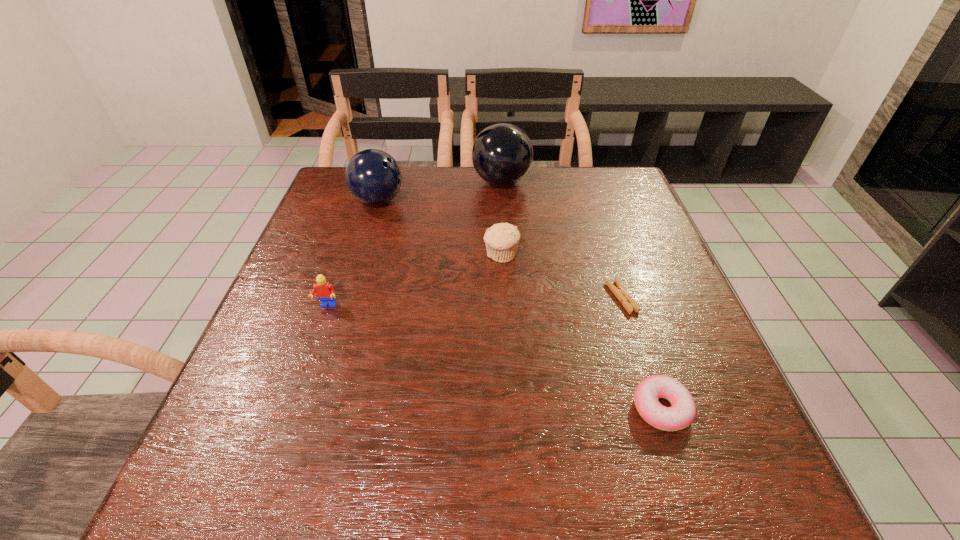
At what (x,y) coordinates should I click in order to perform the action: click on the right bowling ball. Please return your answer as a coordinate pair (x, y). The height and width of the screenshot is (540, 960). Looking at the image, I should click on (502, 154).

The height and width of the screenshot is (540, 960). What are the coordinates of `the second tallest object` in the screenshot? It's located at pos(372,176).

Image resolution: width=960 pixels, height=540 pixels. I want to click on the left bowling ball, so click(372, 176).

Identify the location of the fourth nearest object. This screenshot has width=960, height=540. (502, 239).

At what (x,y) coordinates should I click in order to perform the action: click on Lego. Please return your answer as a coordinate pair (x, y). Looking at the image, I should click on (324, 290).

Locate an element on the screen. The height and width of the screenshot is (540, 960). the fifth tallest object is located at coordinates (681, 414).

Find the location of `doughnut`. doughnut is located at coordinates (681, 414).

The width and height of the screenshot is (960, 540). I want to click on the shortest object, so click(x=620, y=292).

The height and width of the screenshot is (540, 960). I want to click on vacant region located 0.210m on the side of the right bowling ball with the finger holes, so click(x=401, y=182).

Find the location of `vacant space located 0.220m on the side of the right bowling ball with the finger holes`. vacant space located 0.220m on the side of the right bowling ball with the finger holes is located at coordinates click(398, 182).